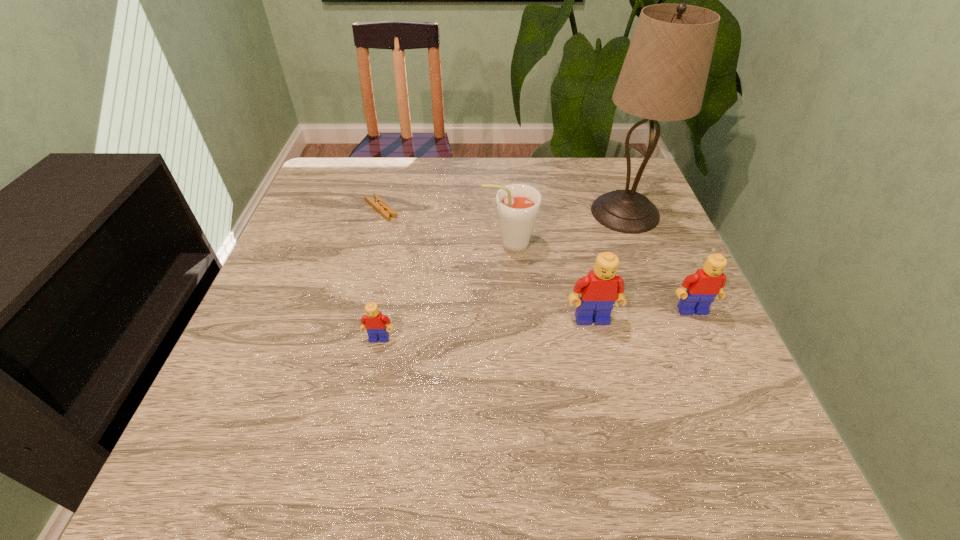
The height and width of the screenshot is (540, 960). I want to click on object that is at the left edge, so click(x=386, y=211).

Where is `Lego located in the right edge section of the desktop`? This screenshot has height=540, width=960. Lego located in the right edge section of the desktop is located at coordinates (707, 283).

The height and width of the screenshot is (540, 960). I want to click on lampshade situated at the right edge, so click(x=663, y=78).

At what (x,y) coordinates should I click in order to perform the action: click on object positioned at the far left corner. Please return your answer as a coordinate pair (x, y). Looking at the image, I should click on (386, 211).

You are a GUI agent. You are given a task and a screenshot of the screen. Output one action in this format:
    pyautogui.click(x=<x>, y=<y>)
    Task: Click on the object situated at the far right corner
    The image size is (960, 540).
    Given the screenshot: What is the action you would take?
    pyautogui.click(x=663, y=78)

Where is `free spot at the far edge of the desktop`? This screenshot has width=960, height=540. free spot at the far edge of the desktop is located at coordinates (416, 174).

The image size is (960, 540). I want to click on free space at the near edge of the desktop, so click(x=348, y=395).

In the image, there is a desktop. Find the location of `vacant space at the left edge`. vacant space at the left edge is located at coordinates (302, 261).

This screenshot has width=960, height=540. What are the coordinates of `vacant area at the right edge` in the screenshot? It's located at (653, 312).

This screenshot has width=960, height=540. Identify the location of vacant region at the far left corner. (346, 197).